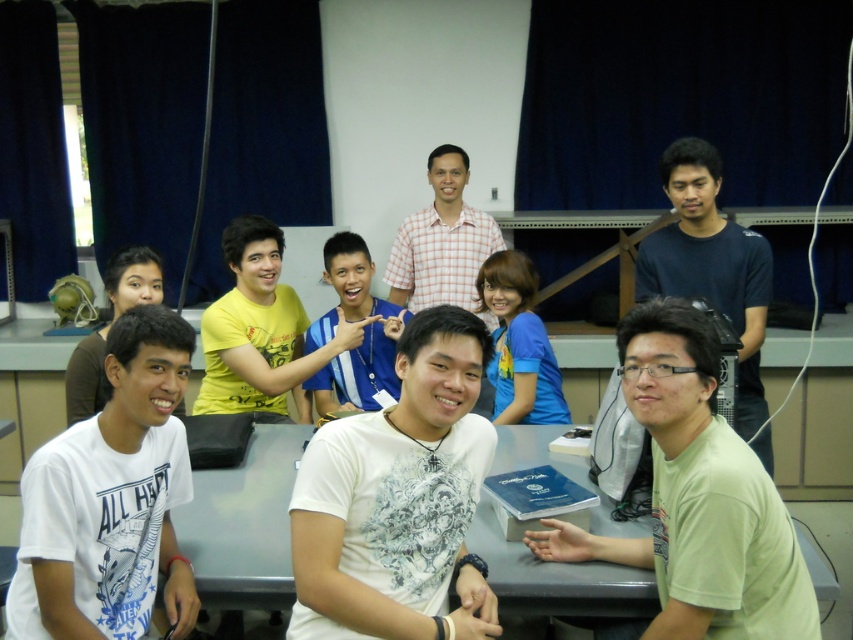
Does green matte shirt at center have a lesser height compared to dark blue t-shirt at right?

Yes, green matte shirt at center is shorter than dark blue t-shirt at right.

Does green matte shirt at center have a lesser width compared to dark blue t-shirt at right?

No, green matte shirt at center is not thinner than dark blue t-shirt at right.

Which is in front, point (744, 524) or point (683, 182)?

Point (744, 524) is more forward.

Where is `green matte shirt at center`? Image resolution: width=853 pixels, height=640 pixels. green matte shirt at center is located at coordinates (695, 499).

From the picture: Measure the distance between white cotton t-shirt at lower left and camera.

A distance of 4.62 feet exists between white cotton t-shirt at lower left and camera.

The height and width of the screenshot is (640, 853). In order to click on white cotton t-shirt at lower left in this screenshot , I will do `click(111, 499)`.

Where is `white cotton t-shirt at lower left`? The height and width of the screenshot is (640, 853). white cotton t-shirt at lower left is located at coordinates (111, 499).

Does green matte shirt at center have a greater height compared to gray plastic table at center?

Yes.

Does green matte shirt at center appear on the right side of gray plastic table at center?

Indeed, green matte shirt at center is positioned on the right side of gray plastic table at center.

Who is more forward, [759,540] or [552,432]?

Point [759,540]

Where is `green matte shirt at center`? Image resolution: width=853 pixels, height=640 pixels. green matte shirt at center is located at coordinates (695, 499).